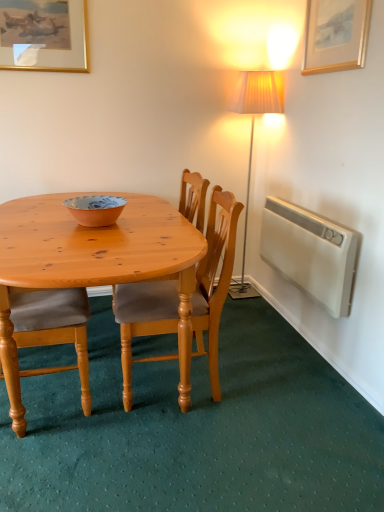
What do you see at coordinates (336, 35) in the screenshot? The image size is (384, 512). I see `wooden picture frame at upper right, marked as the second picture frame in a left-to-right arrangement` at bounding box center [336, 35].

This screenshot has height=512, width=384. I want to click on wooden picture frame at upper right, marked as the second picture frame in a left-to-right arrangement, so click(336, 35).

This screenshot has width=384, height=512. I want to click on light brown wood chair at center, the first chair in the right-to-left sequence, so click(x=214, y=279).

What are the coordinates of `matte orange bowl at center` in the screenshot? It's located at (95, 209).

What do you see at coordinates (43, 35) in the screenshot?
I see `gold-framed picture at upper left, placed as the 1th picture frame when sorted from left to right` at bounding box center [43, 35].

What is the approximate height of white plastic radiator at right?

43.81 centimeters.

You are a GUI agent. You are given a task and a screenshot of the screen. Output one action in this format:
    pyautogui.click(x=<x>, y=<y>)
    Task: Click on the wooden picture frame at upper right, the first picture frame when ordered from front to back
    This screenshot has height=512, width=384.
    Given the screenshot: What is the action you would take?
    [336, 35]

Is matte orange bowl at center inside or outside of gold-framed picture at upper left, the 2th picture frame when ordered from right to left?

matte orange bowl at center is outside gold-framed picture at upper left, the 2th picture frame when ordered from right to left.

From the image's perspective, is matte orange bowl at center below gold-framed picture at upper left, the second picture frame when ordered from front to back?

Yes, from the image's perspective, matte orange bowl at center is beneath gold-framed picture at upper left, the second picture frame when ordered from front to back.

Is matte orange bowl at center beside gold-framed picture at upper left, the 2th picture frame when ordered from right to left?

No, matte orange bowl at center is not next to gold-framed picture at upper left, the 2th picture frame when ordered from right to left.

Which is closer to the camera, (89,209) or (53,62)?

The point (89,209) is closer.

Which is more to the left, light brown wood chair at center, the first chair in the right-to-left sequence, or gold-framed picture at upper left, the 2th picture frame when ordered from right to left?

gold-framed picture at upper left, the 2th picture frame when ordered from right to left, is more to the left.

Is gold-framed picture at upper left, positioned as the 1th picture frame in back-to-front order, at the back of light brown wood chair at center, the 2th chair positioned from the left?

No.

Is light brown wood chair at center, the 2th chair positioned from the left, situated inside gold-framed picture at upper left, the 2th picture frame when ordered from right to left, or outside?

light brown wood chair at center, the 2th chair positioned from the left, exists outside the volume of gold-framed picture at upper left, the 2th picture frame when ordered from right to left.

You are a GUI agent. You are given a task and a screenshot of the screen. Output one action in this format:
    pyautogui.click(x=<x>, y=<y>)
    Task: Click on the radiator below the gold-framed picture at upper left, positioned as the 1th picture frame in back-to-front order (from a real-world perspective)
    The height and width of the screenshot is (512, 384).
    Given the screenshot: What is the action you would take?
    pyautogui.click(x=310, y=253)

Considering the sizes of gold-framed picture at upper left, positioned as the 1th picture frame in back-to-front order, and white plastic radiator at right in the image, is gold-framed picture at upper left, positioned as the 1th picture frame in back-to-front order, taller or shorter than white plastic radiator at right?

In the image, gold-framed picture at upper left, positioned as the 1th picture frame in back-to-front order, appears to be shorter than white plastic radiator at right.

Is gold-framed picture at upper left, the 2th picture frame when ordered from right to left, turned away from white plastic radiator at right?

No.

Can we say gold-framed picture at upper left, the 2th picture frame when ordered from right to left, lies outside white plastic radiator at right?

gold-framed picture at upper left, the 2th picture frame when ordered from right to left, lies outside white plastic radiator at right's area.

Looking at their sizes, would you say wooden picture frame at upper right, the first picture frame when ordered from front to back, is wider or thinner than light brown wood chair at center, the 2th chair positioned from the left?

In the image, wooden picture frame at upper right, the first picture frame when ordered from front to back, appears to be more narrow than light brown wood chair at center, the 2th chair positioned from the left.

From a real-world perspective, between wooden picture frame at upper right, marked as the first picture frame in a right-to-left arrangement, and light brown wood chair at center, the 2th chair positioned from the left, who is vertically lower?

From a 3D spatial view, light brown wood chair at center, the 2th chair positioned from the left, is below.

Is wooden picture frame at upper right, marked as the first picture frame in a right-to-left arrangement, in front of or behind light brown wood chair at center, the 2th chair positioned from the left, in the image?

wooden picture frame at upper right, marked as the first picture frame in a right-to-left arrangement, is positioned farther from the viewer than light brown wood chair at center, the 2th chair positioned from the left.

The width and height of the screenshot is (384, 512). Find the location of `chair that is the 1st object directly below the wooden picture frame at upper right, marked as the second picture frame in a left-to-right arrangement (from a real-world perspective)`. chair that is the 1st object directly below the wooden picture frame at upper right, marked as the second picture frame in a left-to-right arrangement (from a real-world perspective) is located at coordinates (214, 279).

Is white plastic radiator at right located within wooden picture frame at upper right, marked as the first picture frame in a right-to-left arrangement?

That's incorrect, white plastic radiator at right is not inside wooden picture frame at upper right, marked as the first picture frame in a right-to-left arrangement.

Which is in front, wooden picture frame at upper right, which is the 2th picture frame from back to front, or white plastic radiator at right?

wooden picture frame at upper right, which is the 2th picture frame from back to front, is more forward.

Is wooden picture frame at upper right, which is the 2th picture frame from back to front, to the left or to the right of white plastic radiator at right in the image?

Clearly, wooden picture frame at upper right, which is the 2th picture frame from back to front, is on the right of white plastic radiator at right in the image.

Does wooden picture frame at upper right, marked as the second picture frame in a left-to-right arrangement, have a greater height compared to white plastic radiator at right?

In fact, wooden picture frame at upper right, marked as the second picture frame in a left-to-right arrangement, may be shorter than white plastic radiator at right.

Is wooden chair at left, the 1th chair positioned from the left, beside light brown wood chair at center, the first chair in the right-to-left sequence?

No.

Who is more distant, wooden chair at left, the 1th chair positioned from the left, or light brown wood chair at center, the first chair in the right-to-left sequence?

light brown wood chair at center, the first chair in the right-to-left sequence, is further away from the camera.

Is point (38, 338) less distant than point (127, 397)?

Yes, point (38, 338) is closer to viewer.

From the image's perspective, is wooden chair at left, which is the second chair in right-to-left order, located above light brown wood chair at center, the first chair in the right-to-left sequence?

Actually, wooden chair at left, which is the second chair in right-to-left order, appears below light brown wood chair at center, the first chair in the right-to-left sequence, in the image.

Considering the positions of points (310, 250) and (99, 203), is point (310, 250) closer to camera compared to point (99, 203)?

No, (310, 250) is behind (99, 203).

Can you confirm if white plastic radiator at right is taller than matte orange bowl at center?

Correct, white plastic radiator at right is much taller as matte orange bowl at center.

From a real-world perspective, is white plastic radiator at right physically located above or below matte orange bowl at center?

From a real-world perspective, white plastic radiator at right is physically below matte orange bowl at center.

Would you say white plastic radiator at right is inside or outside matte orange bowl at center?

white plastic radiator at right is located beyond the bounds of matte orange bowl at center.

Locate an element on the screen. Image resolution: width=384 pixels, height=512 pixels. picture frame lying behind the matte orange bowl at center is located at coordinates pos(43,35).

The height and width of the screenshot is (512, 384). There is a light brown wood chair at center, the first chair in the right-to-left sequence. Identify the location of the 2nd picture frame above it (from the image's perspective). (43, 35).

Based on their spatial positions, is matte orange bowl at center or wooden picture frame at upper right, marked as the first picture frame in a right-to-left arrangement, further from white plastic radiator at right?

Among the two, matte orange bowl at center is located further to white plastic radiator at right.

Looking at the image, which one is located further to wooden chair at left, the 1th chair positioned from the left, light brown wood chair at center, the 2th chair positioned from the left, or gold-framed picture at upper left, the second picture frame when ordered from front to back?

Among the two, gold-framed picture at upper left, the second picture frame when ordered from front to back, is located further to wooden chair at left, the 1th chair positioned from the left.

Which object lies further to the anchor point wooden picture frame at upper right, which is the 2th picture frame from back to front, matte orange bowl at center or wooden chair at left, which is the second chair in right-to-left order?

Among the two, wooden chair at left, which is the second chair in right-to-left order, is located further to wooden picture frame at upper right, which is the 2th picture frame from back to front.

Based on their spatial positions, is light brown wood chair at center, the 2th chair positioned from the left, or gold-framed picture at upper left, placed as the 1th picture frame when sorted from left to right, closer to matte orange bowl at center?

Based on the image, light brown wood chair at center, the 2th chair positioned from the left, appears to be nearer to matte orange bowl at center.

Looking at the image, which one is located closer to wooden chair at left, the 1th chair positioned from the left, matte orange bowl at center or gold-framed picture at upper left, placed as the 1th picture frame when sorted from left to right?

matte orange bowl at center is closer to wooden chair at left, the 1th chair positioned from the left.

Consider the image. Which object lies further to the anchor point white plastic radiator at right, matte orange bowl at center or gold-framed picture at upper left, positioned as the 1th picture frame in back-to-front order?

Based on the image, gold-framed picture at upper left, positioned as the 1th picture frame in back-to-front order, appears to be further to white plastic radiator at right.

Which object lies nearer to the anchor point gold-framed picture at upper left, the 2th picture frame when ordered from right to left, matte orange bowl at center or light brown wood chair at center, the first chair in the right-to-left sequence?

matte orange bowl at center is positioned closer to the anchor gold-framed picture at upper left, the 2th picture frame when ordered from right to left.

From the image, which object appears to be farther from white plastic radiator at right, matte orange bowl at center or wooden chair at left, which is the second chair in right-to-left order?

wooden chair at left, which is the second chair in right-to-left order.

Locate an element on the screen. This screenshot has height=512, width=384. chair between gold-framed picture at upper left, placed as the 1th picture frame when sorted from left to right, and wooden chair at left, the 1th chair positioned from the left, vertically is located at coordinates (214, 279).

Locate an element on the screen. Image resolution: width=384 pixels, height=512 pixels. bowl between gold-framed picture at upper left, positioned as the 1th picture frame in back-to-front order, and wooden chair at left, which is the second chair in right-to-left order, vertically is located at coordinates pyautogui.click(x=95, y=209).

This screenshot has height=512, width=384. I want to click on chair between wooden chair at left, which is the second chair in right-to-left order, and white plastic radiator at right, so click(x=214, y=279).

Where is `bowl between wooden picture frame at upper right, marked as the second picture frame in a left-to-right arrangement, and light brown wood chair at center, the first chair in the right-to-left sequence, vertically`? This screenshot has height=512, width=384. bowl between wooden picture frame at upper right, marked as the second picture frame in a left-to-right arrangement, and light brown wood chair at center, the first chair in the right-to-left sequence, vertically is located at coordinates (95, 209).